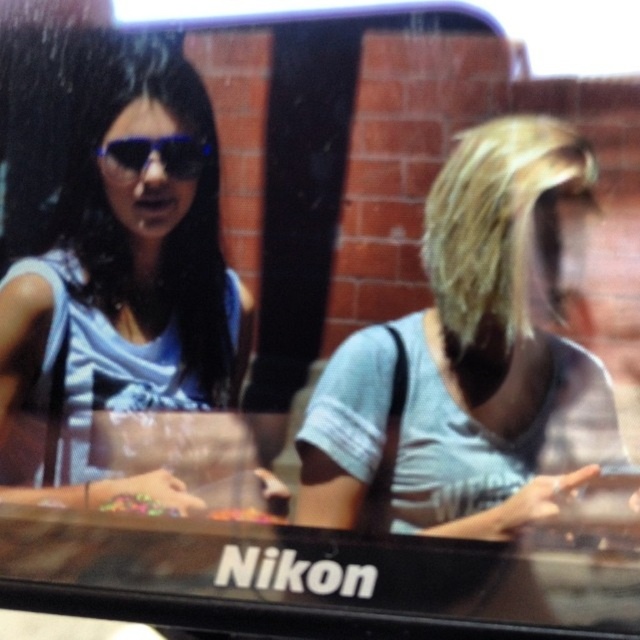
Does gray cotton shirt at right have a smaller size compared to matte blue dress at upper left?

No.

The width and height of the screenshot is (640, 640). Describe the element at coordinates (470, 358) in the screenshot. I see `gray cotton shirt at right` at that location.

Which is behind, point (342, 504) or point (93, 280)?

The point (93, 280) is behind.

This screenshot has height=640, width=640. In order to click on gray cotton shirt at right in this screenshot , I will do `click(470, 358)`.

Based on the photo, which is more to the left, gray cotton shirt at right or matte blue sunglasses at upper left?

matte blue sunglasses at upper left

Who is positioned more to the right, gray cotton shirt at right or matte blue sunglasses at upper left?

Positioned to the right is gray cotton shirt at right.

Does point (314, 488) come in front of point (148, 157)?

No, it is not.

Find the location of a particular element. Image resolution: width=640 pixels, height=640 pixels. gray cotton shirt at right is located at coordinates (470, 358).

Does gray cotton shirt at right have a greater width compared to translucent plastic candy at center?

Yes.

Is gray cotton shirt at right closer to the viewer compared to translucent plastic candy at center?

Yes, gray cotton shirt at right is closer to the viewer.

Does point (595, 420) come in front of point (237, 513)?

Yes.

This screenshot has width=640, height=640. I want to click on gray cotton shirt at right, so click(x=470, y=358).